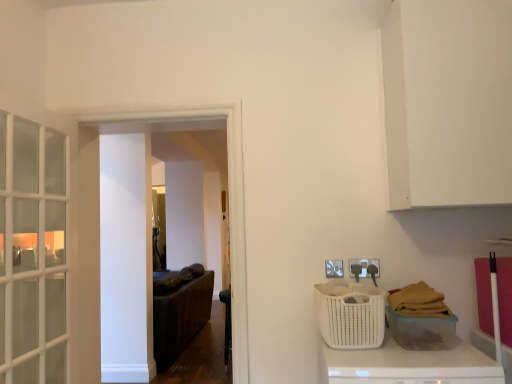
The image size is (512, 384). Find the location of `white wicker basket at lower right, the second basket when ordered from left to right`. white wicker basket at lower right, the second basket when ordered from left to right is located at coordinates (423, 331).

The width and height of the screenshot is (512, 384). What do you see at coordinates (407, 365) in the screenshot?
I see `white matte counter top at lower right` at bounding box center [407, 365].

At what (x,y) coordinates should I click in order to perform the action: click on white woven basket at lower right, the 2th basket viewed from the right. Please return your answer as a coordinate pair (x, y). Looking at the image, I should click on (350, 314).

Could you measure the distance between white matte counter top at lower right and white wicker basket at lower right, the second basket when ordered from left to right?

white matte counter top at lower right and white wicker basket at lower right, the second basket when ordered from left to right, are 5.30 inches apart.

Is white matte counter top at lower right aimed at white wicker basket at lower right, the second basket when ordered from left to right?

No.

From the picture: From the image's perspective, which one is positioned lower, white matte counter top at lower right or white wicker basket at lower right, the second basket when ordered from left to right?

white matte counter top at lower right appears lower in the image.

Is white matte counter top at lower right directly adjacent to white wicker basket at lower right, which is the first basket in right-to-left order?

white matte counter top at lower right and white wicker basket at lower right, which is the first basket in right-to-left order, are clearly separated.

Are white woven basket at lower right, the 2th basket viewed from the right, and black leather chair at center making contact?

They are not placed beside each other.

Considering the relative sizes of white woven basket at lower right, which is the first basket in left-to-right order, and black leather chair at center in the image provided, is white woven basket at lower right, which is the first basket in left-to-right order, bigger than black leather chair at center?

Actually, white woven basket at lower right, which is the first basket in left-to-right order, might be smaller than black leather chair at center.

Identify the location of furniture behind the white woven basket at lower right, the 2th basket viewed from the right. The width and height of the screenshot is (512, 384). (227, 325).

Considering their positions, is white woven basket at lower right, which is the first basket in left-to-right order, located in front of or behind black leather chair at center?

Visually, white woven basket at lower right, which is the first basket in left-to-right order, is located in front of black leather chair at center.

Is white matte counter top at lower right surrounded by white woven basket at lower right, the 2th basket viewed from the right?

No, white matte counter top at lower right is located outside of white woven basket at lower right, the 2th basket viewed from the right.

From the image's perspective, is white woven basket at lower right, which is the first basket in left-to-right order, positioned above or below white matte counter top at lower right?

white woven basket at lower right, which is the first basket in left-to-right order, is above white matte counter top at lower right.

Looking at this image, which object is more forward, white woven basket at lower right, the 2th basket viewed from the right, or white matte counter top at lower right?

white matte counter top at lower right is more forward.

From a real-world perspective, does white woven basket at lower right, which is the first basket in left-to-right order, sit lower than white matte counter top at lower right?

No.

Between black leather chair at center and white wicker basket at lower right, the second basket when ordered from left to right, which one has less height?

white wicker basket at lower right, the second basket when ordered from left to right.

Is black leather chair at center wider than white wicker basket at lower right, which is the first basket in right-to-left order?

No, black leather chair at center is not wider than white wicker basket at lower right, which is the first basket in right-to-left order.

Is there a large distance between black leather chair at center and white wicker basket at lower right, the second basket when ordered from left to right?

Yes.

Measure the distance between black leather chair at center and white wicker basket at lower right, which is the first basket in right-to-left order.

black leather chair at center is 1.12 meters away from white wicker basket at lower right, which is the first basket in right-to-left order.

In the scene shown: Is white wicker basket at lower right, the second basket when ordered from left to right, next to white woven basket at lower right, which is the first basket in left-to-right order?

white wicker basket at lower right, the second basket when ordered from left to right, and white woven basket at lower right, which is the first basket in left-to-right order, are not in contact.

Find the location of `basket below the white woven basket at lower right, which is the first basket in left-to-right order (from the image's perspective)`. basket below the white woven basket at lower right, which is the first basket in left-to-right order (from the image's perspective) is located at coordinates (423, 331).

Considering their positions, is white wicker basket at lower right, which is the first basket in right-to-left order, located in front of or behind white woven basket at lower right, which is the first basket in left-to-right order?

Clearly, white wicker basket at lower right, which is the first basket in right-to-left order, is in front of white woven basket at lower right, which is the first basket in left-to-right order.

From a real-world perspective, is white wicker basket at lower right, which is the first basket in right-to-left order, on top of white woven basket at lower right, the 2th basket viewed from the right?

Incorrect, from a real-world perspective, white wicker basket at lower right, which is the first basket in right-to-left order, is lower than white woven basket at lower right, the 2th basket viewed from the right.

Does white matte counter top at lower right appear on the left side of black leather chair at center?

No, white matte counter top at lower right is not to the left of black leather chair at center.

The height and width of the screenshot is (384, 512). Identify the location of counter top above the black leather chair at center (from a real-world perspective). (407, 365).

Would you say white matte counter top at lower right is inside or outside black leather chair at center?

white matte counter top at lower right is not inside black leather chair at center, it's outside.

How many degrees apart are the facing directions of white matte counter top at lower right and white woven basket at lower right, the 2th basket viewed from the right?

2.08 degrees.

Is white matte counter top at lower right not inside white woven basket at lower right, the 2th basket viewed from the right?

That's correct, white matte counter top at lower right is outside of white woven basket at lower right, the 2th basket viewed from the right.

Is white matte counter top at lower right wider or thinner than white woven basket at lower right, the 2th basket viewed from the right?

white matte counter top at lower right is wider than white woven basket at lower right, the 2th basket viewed from the right.

Between white matte counter top at lower right and white woven basket at lower right, which is the first basket in left-to-right order, which one has more height?

With more height is white matte counter top at lower right.

Image resolution: width=512 pixels, height=384 pixels. In order to click on counter top below the white wicker basket at lower right, which is the first basket in right-to-left order (from a real-world perspective) in this screenshot , I will do `click(407, 365)`.

At what (x,y) coordinates should I click in order to perform the action: click on the 2nd basket directly above the black leather chair at center (from a real-world perspective). Please return your answer as a coordinate pair (x, y). Looking at the image, I should click on tap(350, 314).

Looking at the image, which one is located further to white matte counter top at lower right, black leather chair at center or white wicker basket at lower right, which is the first basket in right-to-left order?

The object further to white matte counter top at lower right is black leather chair at center.

Which object lies nearer to the anchor point white woven basket at lower right, the 2th basket viewed from the right, white wicker basket at lower right, the second basket when ordered from left to right, or black leather chair at center?

Based on the image, white wicker basket at lower right, the second basket when ordered from left to right, appears to be nearer to white woven basket at lower right, the 2th basket viewed from the right.

Based on their spatial positions, is black leather chair at center or white woven basket at lower right, which is the first basket in left-to-right order, closer to white matte counter top at lower right?

white woven basket at lower right, which is the first basket in left-to-right order, lies closer to white matte counter top at lower right than the other object.

Looking at the image, which one is located further to white matte counter top at lower right, white wicker basket at lower right, the second basket when ordered from left to right, or white woven basket at lower right, which is the first basket in left-to-right order?

Among the two, white woven basket at lower right, which is the first basket in left-to-right order, is located further to white matte counter top at lower right.

Which object lies nearer to the anchor point white matte counter top at lower right, white wicker basket at lower right, which is the first basket in right-to-left order, or black leather chair at center?

Among the two, white wicker basket at lower right, which is the first basket in right-to-left order, is located nearer to white matte counter top at lower right.

Based on their spatial positions, is white woven basket at lower right, which is the first basket in left-to-right order, or white matte counter top at lower right further from white wicker basket at lower right, which is the first basket in right-to-left order?

white woven basket at lower right, which is the first basket in left-to-right order, is further to white wicker basket at lower right, which is the first basket in right-to-left order.

Looking at the image, which one is located closer to white wicker basket at lower right, which is the first basket in right-to-left order, white woven basket at lower right, which is the first basket in left-to-right order, or black leather chair at center?

white woven basket at lower right, which is the first basket in left-to-right order.

When comparing their distances from white matte counter top at lower right, does white woven basket at lower right, the 2th basket viewed from the right, or black leather chair at center seem closer?

white woven basket at lower right, the 2th basket viewed from the right.

Identify the location of basket located between white matte counter top at lower right and white woven basket at lower right, the 2th basket viewed from the right, in the depth direction. (423, 331).

What are the coordinates of `basket between white wicker basket at lower right, which is the first basket in right-to-left order, and black leather chair at center, along the z-axis` in the screenshot? It's located at (350, 314).